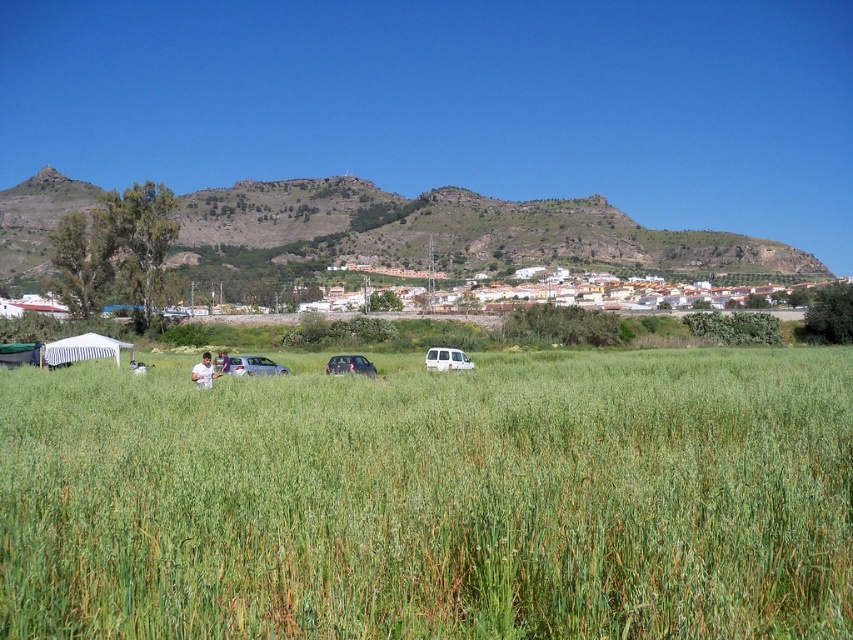
You are standing at the edge of the field looking towards the cars and tent. There are two points marked in the image. Which point is closer to you, point (267, 492) or point (456, 368)?

Point (267, 492) is in front of point (456, 368), so it is closer to you.

You are standing at the point with coordinates point (202, 376) and want to walk towards the point with coordinates point (646, 632). Which direction should you move to reach your destination?

You should move forward because point (646, 632) is in front of point (202, 376).